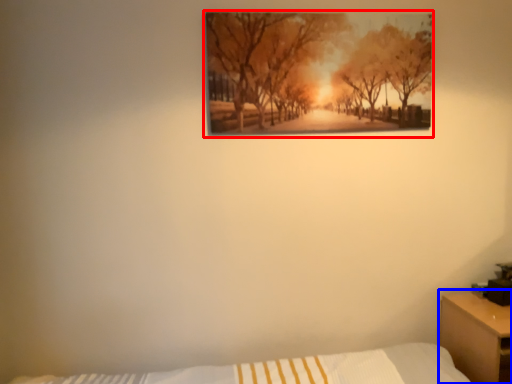
Question: Which point is further to the camera, picture frame (highlighted by a red box) or nightstand (highlighted by a blue box)?

Choices:
 (A) picture frame
 (B) nightstand

Answer: (A)